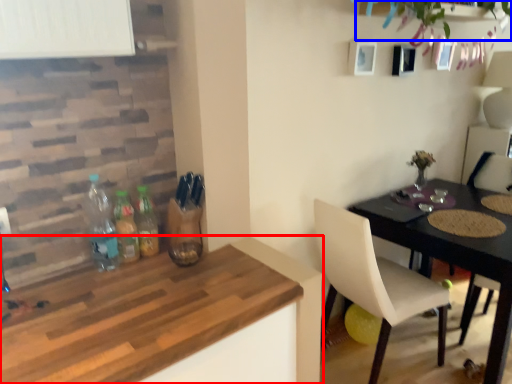
Question: Which of the following is the closest to the observer, kitchen & dining room table (highlighted by a red box) or plant (highlighted by a blue box)?

Choices:
 (A) kitchen & dining room table
 (B) plant

Answer: (A)